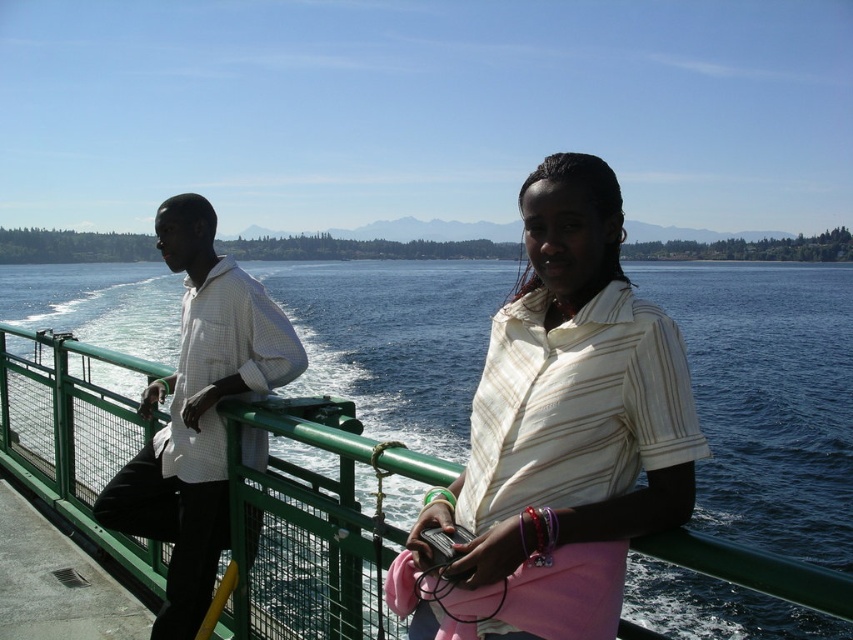
Question: Which object appears closest to the camera in this image?

Choices:
 (A) white checkered shirt at left
 (B) white striped shirt at center

Answer: (B)

Question: Is blue water at center in front of white checkered shirt at left?

Choices:
 (A) yes
 (B) no

Answer: (A)

Question: Can you confirm if white striped shirt at center is positioned above white checkered shirt at left?

Choices:
 (A) no
 (B) yes

Answer: (B)

Question: Considering the relative positions of white striped shirt at center and white checkered shirt at left in the image provided, where is white striped shirt at center located with respect to white checkered shirt at left?

Choices:
 (A) left
 (B) right

Answer: (B)

Question: Which of these objects is positioned closest to the white striped shirt at center?

Choices:
 (A) white checkered shirt at left
 (B) blue water at center

Answer: (A)

Question: Which is farther from the white checkered shirt at left?

Choices:
 (A) blue water at center
 (B) white striped shirt at center

Answer: (A)